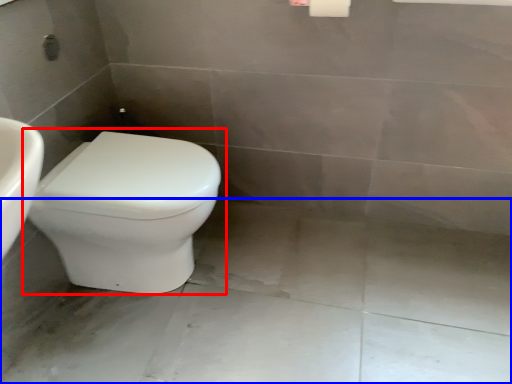
Question: Which object is closer to the camera taking this photo, toilet (highlighted by a red box) or concrete (highlighted by a blue box)?

Choices:
 (A) toilet
 (B) concrete

Answer: (B)